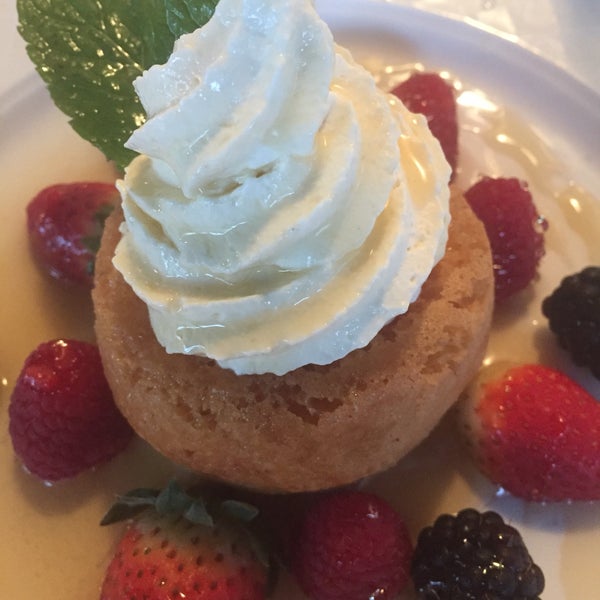
You are a GUI agent. You are given a task and a screenshot of the screen. Output one action in this format:
    pyautogui.click(x=<x>, y=<y>)
    Task: Click on the empty space on table
    This screenshot has width=600, height=600.
    Given the screenshot: What is the action you would take?
    pyautogui.click(x=14, y=55)